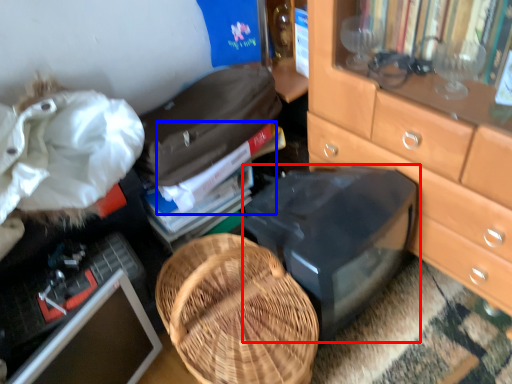
Question: Which point is closer to the camera, desktop (highlighted by a red box) or book (highlighted by a blue box)?

Choices:
 (A) desktop
 (B) book

Answer: (A)